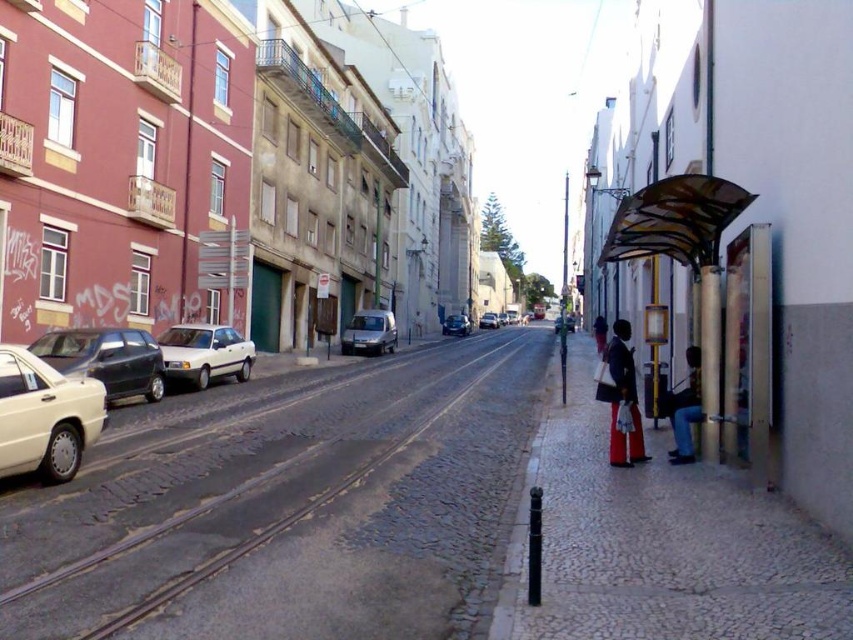
Is white glossy sedan at lower left shorter than white matte car at center-left?

No, white glossy sedan at lower left is not shorter than white matte car at center-left.

Does white glossy sedan at lower left lie in front of white matte car at center-left?

Yes, it is.

Between point (36, 461) and point (204, 348), which one is positioned behind?

Positioned behind is point (204, 348).

Locate an element on the screen. The image size is (853, 640). white glossy sedan at lower left is located at coordinates (45, 417).

From the picture: Does cobblestone train track at center have a greater width compared to jeans at right?

Indeed, cobblestone train track at center has a greater width compared to jeans at right.

Can you confirm if cobblestone train track at center is positioned to the right of jeans at right?

Incorrect, cobblestone train track at center is not on the right side of jeans at right.

This screenshot has width=853, height=640. Identify the location of cobblestone train track at center. (288, 506).

Between point (519, 371) and point (601, 330), which one is positioned in front?

Positioned in front is point (519, 371).

Is cobblestone train track at center thinner than red pants at right?

In fact, cobblestone train track at center might be wider than red pants at right.

Does point (543, 328) lie in front of point (596, 346)?

No, it is behind (596, 346).

Find the location of `cobblestone train track at center`. cobblestone train track at center is located at coordinates (288, 506).